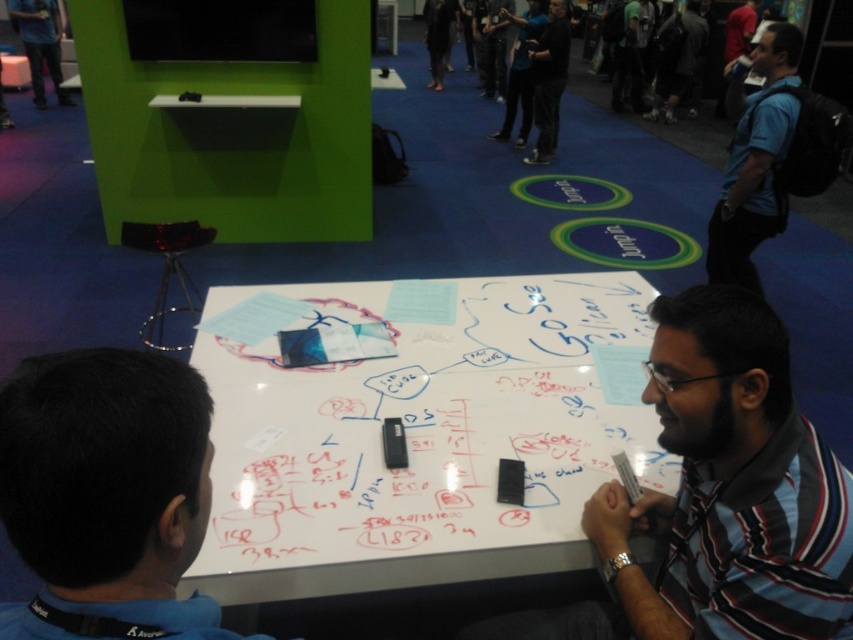
Question: Is blue shirt at right to the right of black matte shirt at center from the viewer's perspective?

Choices:
 (A) yes
 (B) no

Answer: (A)

Question: Which object appears farthest from the camera in this image?

Choices:
 (A) blue shirt at right
 (B) dark blue shirt at upper left

Answer: (B)

Question: Which object is positioned closest to the dark blue shirt at upper left?

Choices:
 (A) blue shirt at lower left
 (B) striped shirt at lower right
 (C) black matte shirt at center

Answer: (C)

Question: Is white glossy table at center thinner than black matte shirt at center?

Choices:
 (A) yes
 (B) no

Answer: (B)

Question: Which is nearer to the blue shirt at right?

Choices:
 (A) striped shirt at lower right
 (B) black matte shirt at center

Answer: (A)

Question: Is striped shirt at lower right bigger than black matte shirt at center?

Choices:
 (A) no
 (B) yes

Answer: (A)